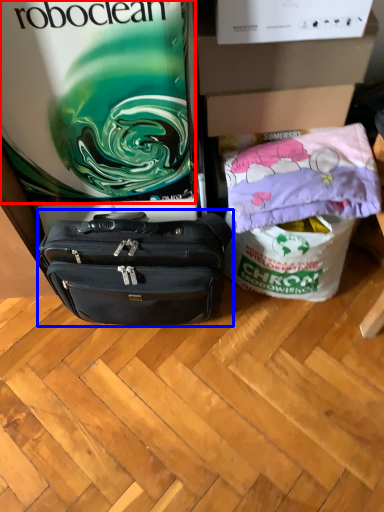
Question: Which object appears closest to the camera in this image, gift bag (highlighted by a red box) or luggage and bags (highlighted by a blue box)?

Choices:
 (A) gift bag
 (B) luggage and bags

Answer: (A)